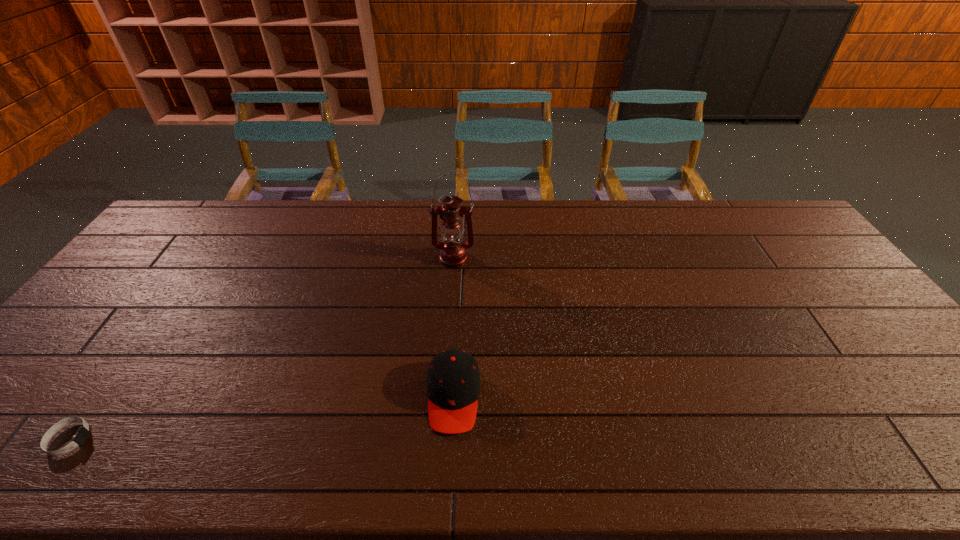
Locate an element on the screen. free location that satisfies the following two spatial constraints: 1. on the front-facing side of the cap; 2. on the outer surface of the leftmost object is located at coordinates (451, 439).

At what (x,y) coordinates should I click in order to perform the action: click on free space that satisfies the following two spatial constraints: 1. on the front-facing side of the second tallest object; 2. on the outer surface of the wristband. Please return your answer as a coordinate pair (x, y). The width and height of the screenshot is (960, 540). Looking at the image, I should click on (451, 439).

The height and width of the screenshot is (540, 960). What are the coordinates of `vacant space that satisfies the following two spatial constraints: 1. on the front-facing side of the cap; 2. on the outer surface of the shortest object` in the screenshot? It's located at (451, 439).

You are a GUI agent. You are given a task and a screenshot of the screen. Output one action in this format:
    pyautogui.click(x=<x>, y=<y>)
    Task: Click on the free space in the image that satisfies the following two spatial constraints: 1. on the front-facing side of the cap; 2. on the outer surface of the wristband
    The image size is (960, 540).
    Given the screenshot: What is the action you would take?
    pyautogui.click(x=451, y=439)